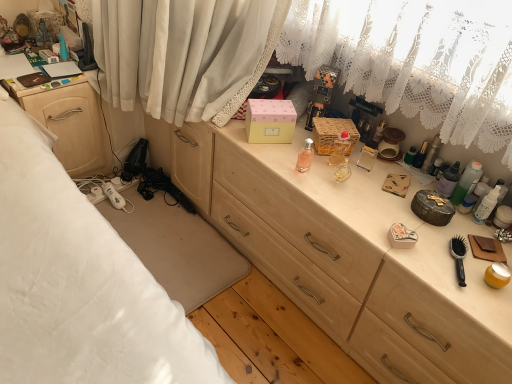
This screenshot has height=384, width=512. I want to click on vacant space positioned to the left of pink matte box at center, so click(223, 124).